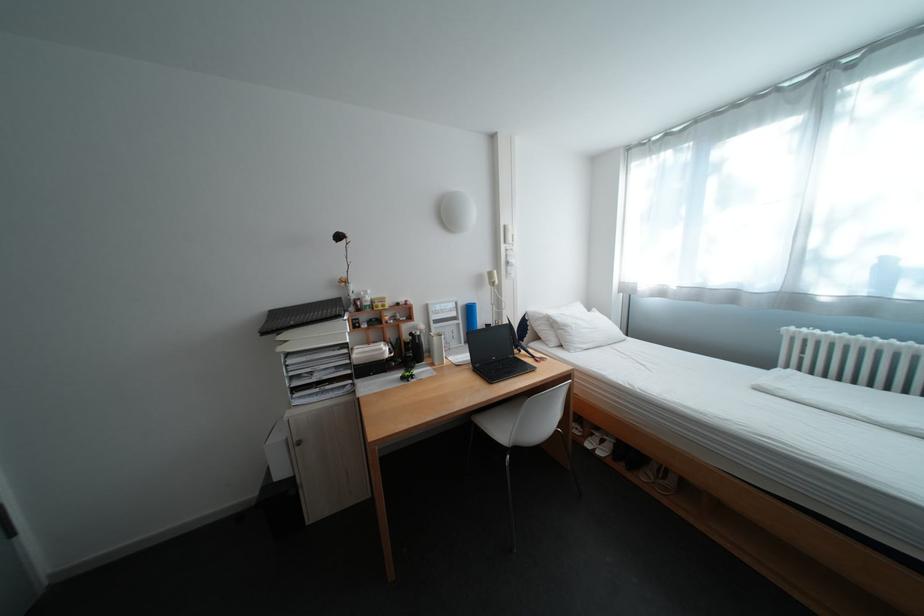
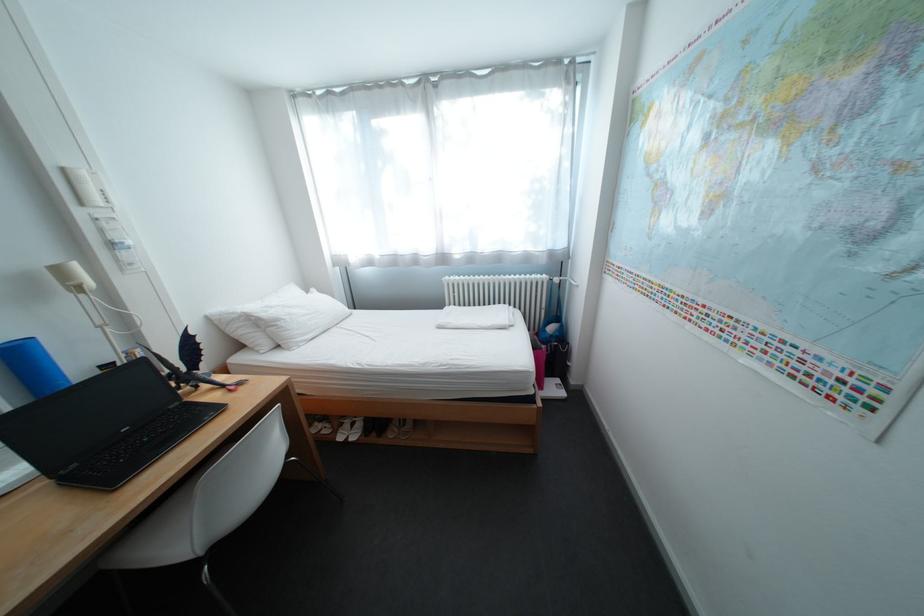
The point at (517, 228) is marked in the first image. Where is the corresponding point in the second image?

(76, 171)